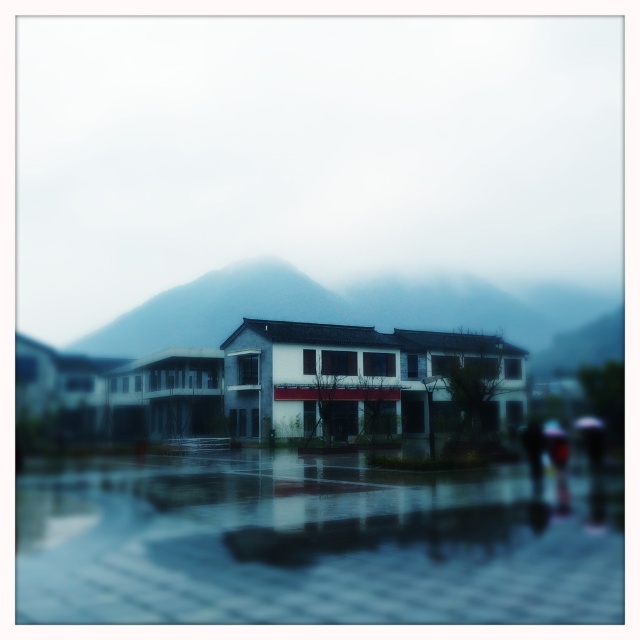
You are standing in front of the traditional building with a modern twist and want to take a photo of the glossy reflective water at lower center. Where exactly should you aim your camera to capture it?

You should aim your camera at point 0.853 on the horizontal axis and 0.486 on the vertical axis to capture the glossy reflective water at lower center.

You are standing in front of the traditional building and want to take a photo of the matte gray mountain at center. However, there is a glossy reflective water at lower center in the way. Can you see the mountain through the water?

The glossy reflective water at lower center is below the matte gray mountain at center, so the water is positioned under the mountain. Since the water is reflective, it might reflect the mountain above it, allowing you to see its reflection but not the actual mountain directly through the water.